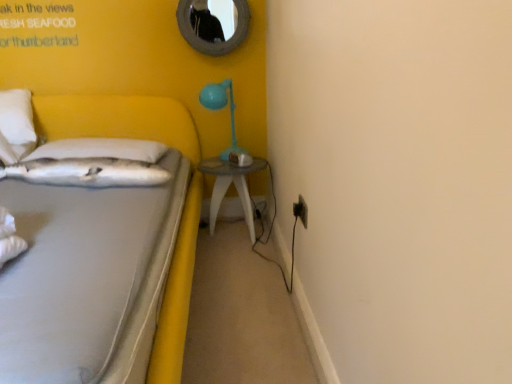
Question: Is white fabric bed at left oriented away from matte blue plastic table lamp at upper right?

Choices:
 (A) no
 (B) yes

Answer: (A)

Question: Considering the relative positions of white fabric bed at left and matte blue plastic table lamp at upper right in the image provided, is white fabric bed at left to the right of matte blue plastic table lamp at upper right from the viewer's perspective?

Choices:
 (A) yes
 (B) no

Answer: (B)

Question: Is white fabric bed at left outside matte blue plastic table lamp at upper right?

Choices:
 (A) no
 (B) yes

Answer: (B)

Question: Is white fabric bed at left smaller than matte blue plastic table lamp at upper right?

Choices:
 (A) no
 (B) yes

Answer: (A)

Question: Can you confirm if white fabric bed at left is positioned to the left of matte blue plastic table lamp at upper right?

Choices:
 (A) no
 (B) yes

Answer: (B)

Question: In terms of size, does rounded silver mirror at upper center appear bigger or smaller than clear glass table at center?

Choices:
 (A) big
 (B) small

Answer: (B)

Question: Would you say rounded silver mirror at upper center is to the left or to the right of clear glass table at center in the picture?

Choices:
 (A) right
 (B) left

Answer: (B)

Question: From the image's perspective, is rounded silver mirror at upper center located above or below clear glass table at center?

Choices:
 (A) below
 (B) above

Answer: (B)

Question: In terms of width, does rounded silver mirror at upper center look wider or thinner when compared to clear glass table at center?

Choices:
 (A) thin
 (B) wide

Answer: (A)

Question: Is rounded silver mirror at upper center to the left or to the right of white soft pillow at left, which is counted as the second pillow, starting from the back, in the image?

Choices:
 (A) left
 (B) right

Answer: (B)

Question: Considering their positions, is rounded silver mirror at upper center located in front of or behind white soft pillow at left, which is counted as the second pillow, starting from the back?

Choices:
 (A) behind
 (B) front

Answer: (A)

Question: Do you think rounded silver mirror at upper center is within white soft pillow at left, which appears as the first pillow when viewed from the front, or outside of it?

Choices:
 (A) inside
 (B) outside

Answer: (B)

Question: Looking at the image, does rounded silver mirror at upper center seem bigger or smaller compared to white soft pillow at left, which appears as the first pillow when viewed from the front?

Choices:
 (A) big
 (B) small

Answer: (B)

Question: Is white fabric bed at left inside the boundaries of white soft pillow at left, which ranks as the first pillow in back-to-front order, or outside?

Choices:
 (A) inside
 (B) outside

Answer: (B)

Question: Based on their positions, is white fabric bed at left located to the left or right of white soft pillow at left, which ranks as the first pillow in back-to-front order?

Choices:
 (A) left
 (B) right

Answer: (A)